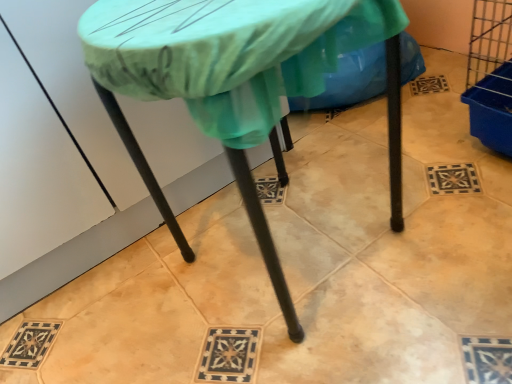
Where is `free space in front of green fabric at center`? This screenshot has height=384, width=512. free space in front of green fabric at center is located at coordinates (384, 142).